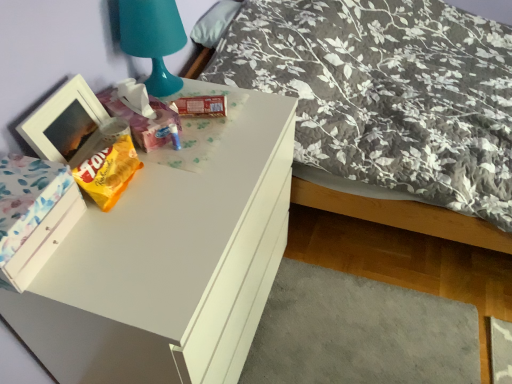
The height and width of the screenshot is (384, 512). What do you see at coordinates (403, 215) in the screenshot? I see `floral fabric bed at upper right` at bounding box center [403, 215].

The image size is (512, 384). Describe the element at coordinates (65, 124) in the screenshot. I see `white matte picture frame at left` at that location.

Image resolution: width=512 pixels, height=384 pixels. Identify the location of fluffy gray pillow at upper center. (214, 23).

The image size is (512, 384). In order to click on white glossy desk at upper left in this screenshot , I will do `click(168, 262)`.

This screenshot has height=384, width=512. What do you see at coordinates (201, 106) in the screenshot? I see `matte brown package at upper center, the first package positioned from the right` at bounding box center [201, 106].

What are the coordinates of `white painted wood drawer at lower left` in the screenshot? It's located at (42, 241).

Where is `teal plastic table lamp at upper left`? This screenshot has width=512, height=384. teal plastic table lamp at upper left is located at coordinates (153, 39).

From the image's perspective, is floral fabric bed at upper right above or below white matte picture frame at left?

floral fabric bed at upper right is situated higher than white matte picture frame at left in the image.

Between floral fabric bed at upper right and white matte picture frame at left, which one has more height?

Standing taller between the two is floral fabric bed at upper right.

Considering the sizes of objects floral fabric bed at upper right and white matte picture frame at left in the image provided, who is thinner, floral fabric bed at upper right or white matte picture frame at left?

white matte picture frame at left.

Considering the relative positions of floral fabric bed at upper right and white matte picture frame at left in the image provided, is floral fabric bed at upper right behind white matte picture frame at left?

Yes, it is behind white matte picture frame at left.

Considering the relative sizes of matte brown package at upper center, the first package positioned from the right, and white painted wood drawer at lower left in the image provided, is matte brown package at upper center, the first package positioned from the right, wider than white painted wood drawer at lower left?

Correct, the width of matte brown package at upper center, the first package positioned from the right, exceeds that of white painted wood drawer at lower left.

Which is behind, point (217, 96) or point (77, 212)?

Point (217, 96)

Does matte brown package at upper center, which is the second package in left-to-right order, have a lesser height compared to white painted wood drawer at lower left?

Yes.

Between matte brown package at upper center, which is the second package in left-to-right order, and white painted wood drawer at lower left, which one has smaller size?

Smaller between the two is matte brown package at upper center, which is the second package in left-to-right order.

Is point (206, 32) closer or farther from the camera than point (45, 221)?

Clearly, point (206, 32) is more distant from the camera than point (45, 221).

Looking at this image, is there a large distance between fluffy gray pillow at upper center and white painted wood drawer at lower left?

That's right, there is a large distance between fluffy gray pillow at upper center and white painted wood drawer at lower left.

Is fluffy gray pillow at upper center facing towards white painted wood drawer at lower left?

No, fluffy gray pillow at upper center is not facing towards white painted wood drawer at lower left.

Looking at this image, considering the sizes of objects fluffy gray pillow at upper center and white painted wood drawer at lower left in the image provided, who is shorter, fluffy gray pillow at upper center or white painted wood drawer at lower left?

fluffy gray pillow at upper center.

Is the surface of matte plastic tissue box at upper center, which is the 1th package in left-to-right order, in direct contact with white glossy desk at upper left?

No, matte plastic tissue box at upper center, which is the 1th package in left-to-right order, is not with white glossy desk at upper left.

Does point (118, 103) come closer to viewer compared to point (219, 187)?

No, (118, 103) is behind (219, 187).

Is matte plastic tissue box at upper center, the 2th package from the right, aimed at white glossy desk at upper left?

No, matte plastic tissue box at upper center, the 2th package from the right, is not turned towards white glossy desk at upper left.

From a real-world perspective, is matte plastic tissue box at upper center, the 2th package from the right, physically below white glossy desk at upper left?

Actually, matte plastic tissue box at upper center, the 2th package from the right, is physically above white glossy desk at upper left in the real world.

Could you tell me if teal plastic table lamp at upper left is facing yellow matte snack packet at left?

No, teal plastic table lamp at upper left is not facing towards yellow matte snack packet at left.

Considering the sizes of objects teal plastic table lamp at upper left and yellow matte snack packet at left in the image provided, who is thinner, teal plastic table lamp at upper left or yellow matte snack packet at left?

yellow matte snack packet at left.

Does point (143, 52) lie in front of point (122, 180)?

No.

The height and width of the screenshot is (384, 512). I want to click on table lamp above the yellow matte snack packet at left (from the image's perspective), so click(x=153, y=39).

Is yellow matte snack packet at left turned away from white matte picture frame at left?

Yes, white matte picture frame at left is at the back of yellow matte snack packet at left.

At what (x,y) coordinates should I click in order to perform the action: click on picture frame behind the yellow matte snack packet at left. Please return your answer as a coordinate pair (x, y). The height and width of the screenshot is (384, 512). Looking at the image, I should click on (65, 124).

Is yellow matte snack packet at left in contact with white matte picture frame at left?

Yes, yellow matte snack packet at left and white matte picture frame at left clearly make contact.

Based on their sizes in the image, would you say yellow matte snack packet at left is bigger or smaller than white matte picture frame at left?

Clearly, yellow matte snack packet at left is smaller in size than white matte picture frame at left.

Is white painted wood drawer at lower left thinner than yellow matte snack packet at left?

Incorrect, the width of white painted wood drawer at lower left is not less than that of yellow matte snack packet at left.

Is white painted wood drawer at lower left bigger or smaller than yellow matte snack packet at left?

white painted wood drawer at lower left is bigger than yellow matte snack packet at left.

Find the location of a particular element. This screenshot has height=384, width=512. drawer located above the yellow matte snack packet at left (from a real-world perspective) is located at coordinates (42, 241).

Locate an element on the screen. The image size is (512, 384). bed on the right of white matte picture frame at left is located at coordinates [x=403, y=215].

You are a GUI agent. You are given a task and a screenshot of the screen. Output one action in this format:
    pyautogui.click(x=<x>, y=<y>)
    Task: Click on the drawer that is above the matte brown package at upper center, which is the second package in left-to-right order (from a real-world perspective)
    The height and width of the screenshot is (384, 512).
    Given the screenshot: What is the action you would take?
    pyautogui.click(x=42, y=241)

From the image, which object appears to be nearer to white matte picture frame at left, white painted wood drawer at lower left or floral fabric bed at upper right?

white painted wood drawer at lower left lies closer to white matte picture frame at left than the other object.

From the image, which object appears to be nearer to teal plastic table lamp at upper left, yellow matte snack packet at left or white matte picture frame at left?

white matte picture frame at left lies closer to teal plastic table lamp at upper left than the other object.

When comparing their distances from fluffy gray pillow at upper center, does teal plastic table lamp at upper left or white painted wood drawer at lower left seem closer?

Based on the image, teal plastic table lamp at upper left appears to be nearer to fluffy gray pillow at upper center.

Based on their spatial positions, is teal plastic table lamp at upper left or yellow matte snack packet at left further from fluffy gray pillow at upper center?

yellow matte snack packet at left.

Based on the photo, which object lies further to the anchor point white painted wood drawer at lower left, fluffy gray pillow at upper center or matte plastic tissue box at upper center, which is the 1th package in left-to-right order?

fluffy gray pillow at upper center is positioned further to the anchor white painted wood drawer at lower left.

When comparing their distances from matte brown package at upper center, the first package positioned from the right, does yellow matte snack packet at left or white painted wood drawer at lower left seem further?

The object further to matte brown package at upper center, the first package positioned from the right, is white painted wood drawer at lower left.

Considering their positions, is fluffy gray pillow at upper center positioned closer to white glossy desk at upper left than floral fabric bed at upper right?

The object closer to white glossy desk at upper left is floral fabric bed at upper right.

In the scene shown: Which object lies nearer to the anchor point floral fabric bed at upper right, white painted wood drawer at lower left or white matte picture frame at left?

white matte picture frame at left lies closer to floral fabric bed at upper right than the other object.

This screenshot has width=512, height=384. I want to click on stuff between teal plastic table lamp at upper left and white glossy desk at upper left in the vertical direction, so click(x=108, y=170).

At what (x,y) coordinates should I click in order to perform the action: click on table lamp between white painted wood drawer at lower left and fluffy gray pillow at upper center in the front-back direction. Please return your answer as a coordinate pair (x, y). This screenshot has height=384, width=512. Looking at the image, I should click on (x=153, y=39).

The image size is (512, 384). Find the location of `desk located between teal plastic table lamp at upper left and floral fabric bed at upper right in the left-right direction`. desk located between teal plastic table lamp at upper left and floral fabric bed at upper right in the left-right direction is located at coordinates (168, 262).

Identify the location of picture frame located between white painted wood drawer at lower left and matte brown package at upper center, which is the second package in left-to-right order, in the depth direction. The image size is (512, 384). (65, 124).